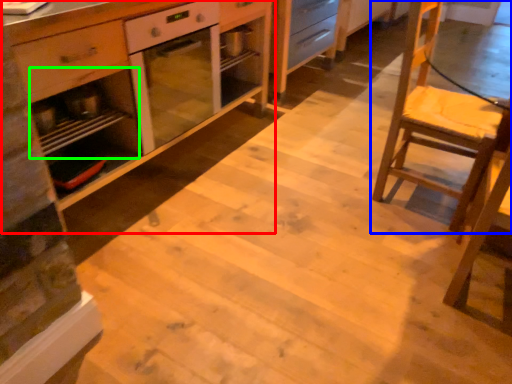
Question: Estimate the real-world distances between objects in this image. Which object is farther from cabinetry (highlighted by a red box), chair (highlighted by a blue box) or shelf (highlighted by a green box)?

Choices:
 (A) chair
 (B) shelf

Answer: (A)